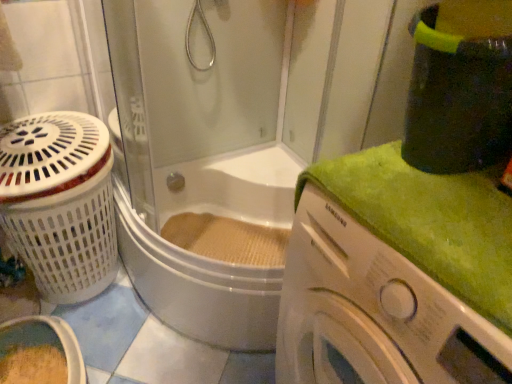
This screenshot has width=512, height=384. What do you see at coordinates (373, 312) in the screenshot?
I see `white glossy washing machine at right` at bounding box center [373, 312].

Where is `white glossy washing machine at right`? white glossy washing machine at right is located at coordinates (373, 312).

What do you see at coordinates (60, 202) in the screenshot?
I see `white plastic laundry basket at left` at bounding box center [60, 202].

What are the coordinates of `white plastic laundry basket at left` in the screenshot? It's located at (60, 202).

Measure the distance between transparent glass shower door at upper center and camera.

transparent glass shower door at upper center is 1.11 meters from camera.

Identify the location of white glossy washing machine at right. The width and height of the screenshot is (512, 384). (373, 312).

Is transparent glass shower door at upper center directly adjacent to white plastic laundry basket at left?

No, transparent glass shower door at upper center is not in contact with white plastic laundry basket at left.

From a real-world perspective, which object rests below the other?

white plastic laundry basket at left.

Can you confirm if transparent glass shower door at upper center is shorter than white plastic laundry basket at left?

In fact, transparent glass shower door at upper center may be taller than white plastic laundry basket at left.

Is transparent glass shower door at upper center facing away from white plastic laundry basket at left?

No, white plastic laundry basket at left is not at the back of transparent glass shower door at upper center.

In the scene shown: Which is more to the right, white plastic laundry basket at left or transparent glass shower door at upper center?

From the viewer's perspective, transparent glass shower door at upper center appears more on the right side.

Considering the sizes of white plastic laundry basket at left and transparent glass shower door at upper center in the image, is white plastic laundry basket at left taller or shorter than transparent glass shower door at upper center?

white plastic laundry basket at left is shorter than transparent glass shower door at upper center.

Is white plastic laundry basket at left located outside transparent glass shower door at upper center?

Absolutely, white plastic laundry basket at left is external to transparent glass shower door at upper center.

Considering the sizes of white plastic laundry basket at left and transparent glass shower door at upper center in the image, is white plastic laundry basket at left wider or thinner than transparent glass shower door at upper center?

white plastic laundry basket at left is thinner than transparent glass shower door at upper center.

From the image's perspective, is white glossy washing machine at right on transparent glass shower door at upper center?

Actually, white glossy washing machine at right appears below transparent glass shower door at upper center in the image.

Is white glossy washing machine at right taller than transparent glass shower door at upper center?

Incorrect, the height of white glossy washing machine at right is not larger of that of transparent glass shower door at upper center.

Is transparent glass shower door at upper center completely or partially inside white glossy washing machine at right?

No, transparent glass shower door at upper center is not surrounded by white glossy washing machine at right.

Is white glossy washing machine at right not close to transparent glass shower door at upper center?

No, white glossy washing machine at right is not far from transparent glass shower door at upper center.

From the image's perspective, does white plastic laundry basket at left appear higher than white glossy washing machine at right?

Incorrect, from the image's perspective, white plastic laundry basket at left is lower than white glossy washing machine at right.

Can we say white plastic laundry basket at left lies outside white glossy washing machine at right?

Yes, white plastic laundry basket at left is located beyond the bounds of white glossy washing machine at right.

Identify the location of basket below the white glossy washing machine at right (from a real-world perspective). The image size is (512, 384). (60, 202).

Does white plastic laundry basket at left touch white glossy washing machine at right?

white plastic laundry basket at left and white glossy washing machine at right are not in contact.

Between point (309, 187) and point (68, 271), which one is positioned in front?

Point (309, 187)

Considering the relative sizes of white glossy washing machine at right and white plastic laundry basket at left in the image provided, is white glossy washing machine at right bigger than white plastic laundry basket at left?

Actually, white glossy washing machine at right might be smaller than white plastic laundry basket at left.

From the image's perspective, would you say white glossy washing machine at right is shown under white plastic laundry basket at left?

No, from the image's perspective, white glossy washing machine at right is not beneath white plastic laundry basket at left.

Between transparent glass shower door at upper center and white glossy washing machine at right, which one has less height?

With less height is white glossy washing machine at right.

Can you tell me how much transparent glass shower door at upper center and white glossy washing machine at right differ in facing direction?

They differ by 0.377 degrees in their facing directions.

From the image's perspective, does transparent glass shower door at upper center appear lower than white glossy washing machine at right?

Incorrect, from the image's perspective, transparent glass shower door at upper center is higher than white glossy washing machine at right.

From a real-world perspective, between transparent glass shower door at upper center and white glossy washing machine at right, who is vertically lower?

transparent glass shower door at upper center is physically lower.

Locate an element on the screen. The height and width of the screenshot is (384, 512). basket located below the transparent glass shower door at upper center (from the image's perspective) is located at coordinates (60, 202).

Identify the location of basket located on the left of transparent glass shower door at upper center. (60, 202).

From the image, which object appears to be nearer to white plastic laundry basket at left, white glossy washing machine at right or transparent glass shower door at upper center?

Among the two, transparent glass shower door at upper center is located nearer to white plastic laundry basket at left.

Considering their positions, is white plastic laundry basket at left positioned closer to transparent glass shower door at upper center than white glossy washing machine at right?

white plastic laundry basket at left.

Estimate the real-world distances between objects in this image. Which object is further from transparent glass shower door at upper center, white glossy washing machine at right or white plastic laundry basket at left?

The object further to transparent glass shower door at upper center is white glossy washing machine at right.

When comparing their distances from white glossy washing machine at right, does white plastic laundry basket at left or transparent glass shower door at upper center seem further?

white plastic laundry basket at left is positioned further to the anchor white glossy washing machine at right.

Based on their spatial positions, is transparent glass shower door at upper center or white glossy washing machine at right closer to white plastic laundry basket at left?

Based on the image, transparent glass shower door at upper center appears to be nearer to white plastic laundry basket at left.

From the image, which object appears to be nearer to white glossy washing machine at right, transparent glass shower door at upper center or white plastic laundry basket at left?

The object closer to white glossy washing machine at right is transparent glass shower door at upper center.

This screenshot has height=384, width=512. I want to click on shower door between white plastic laundry basket at left and white glossy washing machine at right from left to right, so click(229, 138).